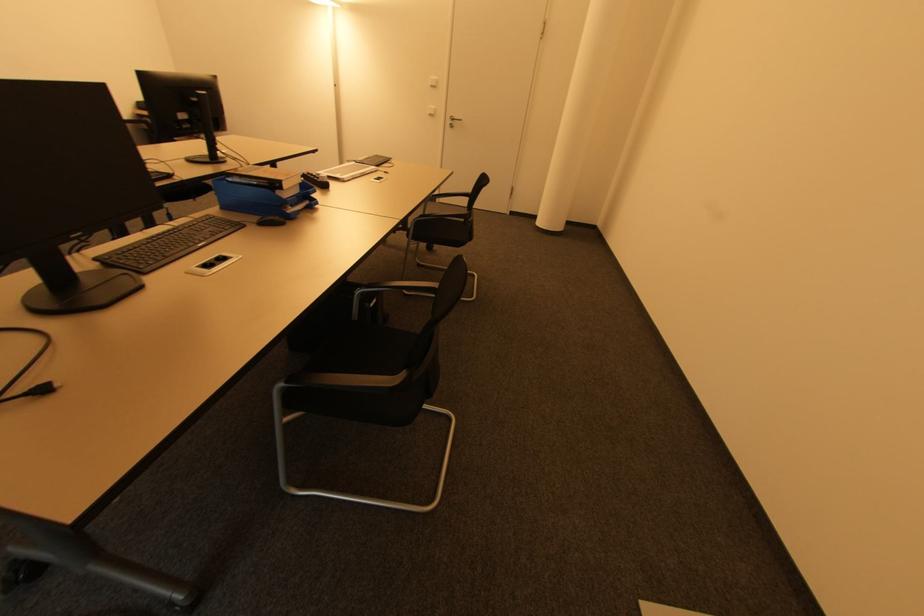
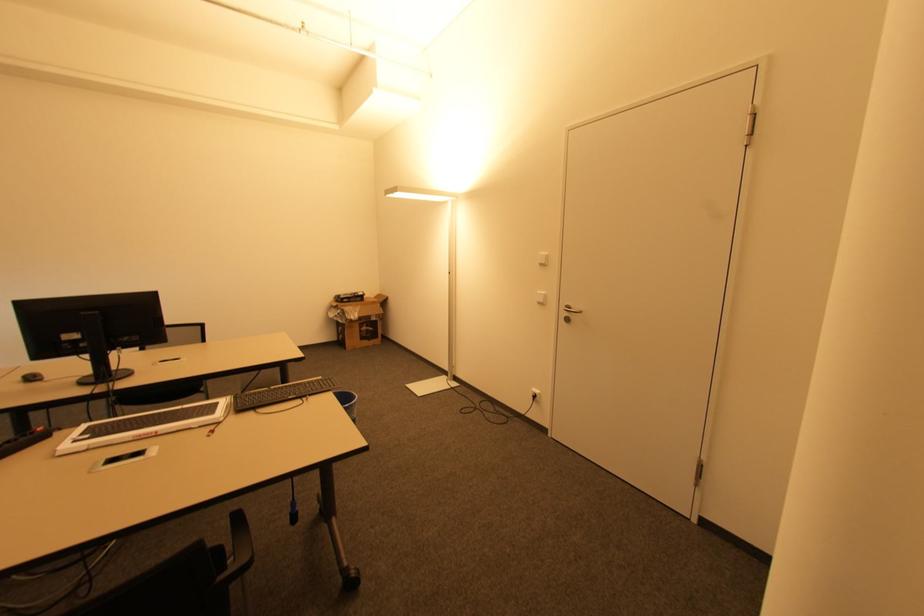
Find the pixel in the second image that matches pixel 434 87 in the first image.

(542, 265)